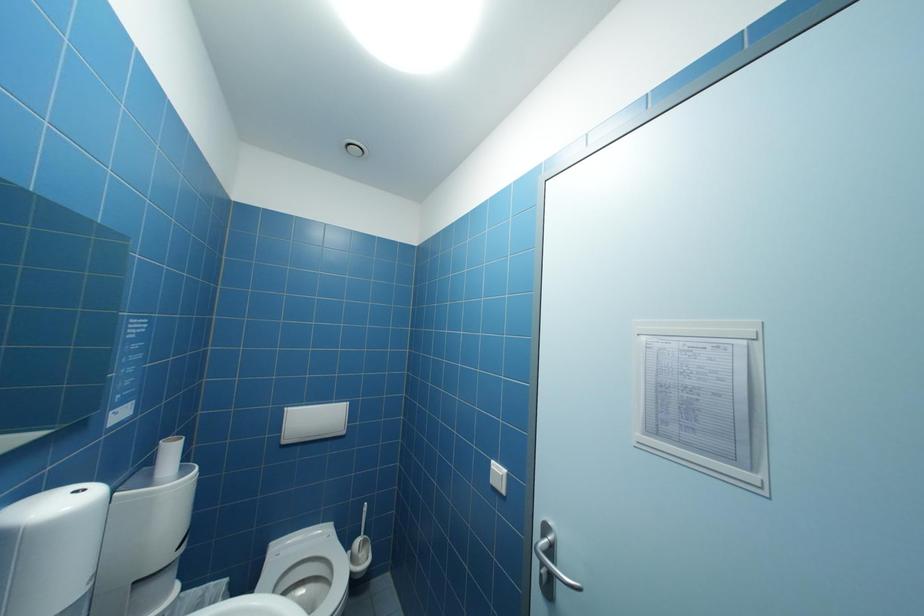
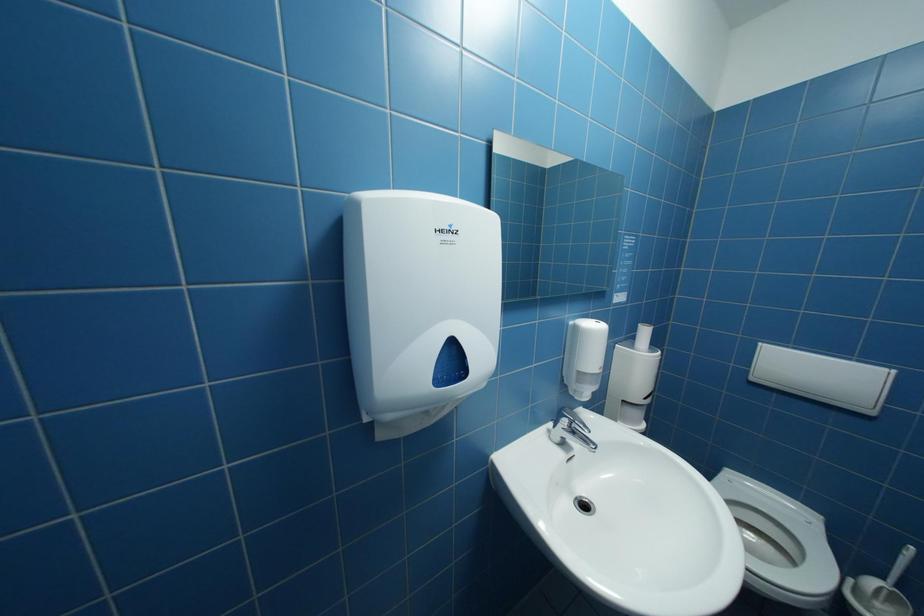
Question: How did the camera likely rotate?

Choices:
 (A) Left
 (B) Right
 (C) Up
 (D) Down

Answer: (A)